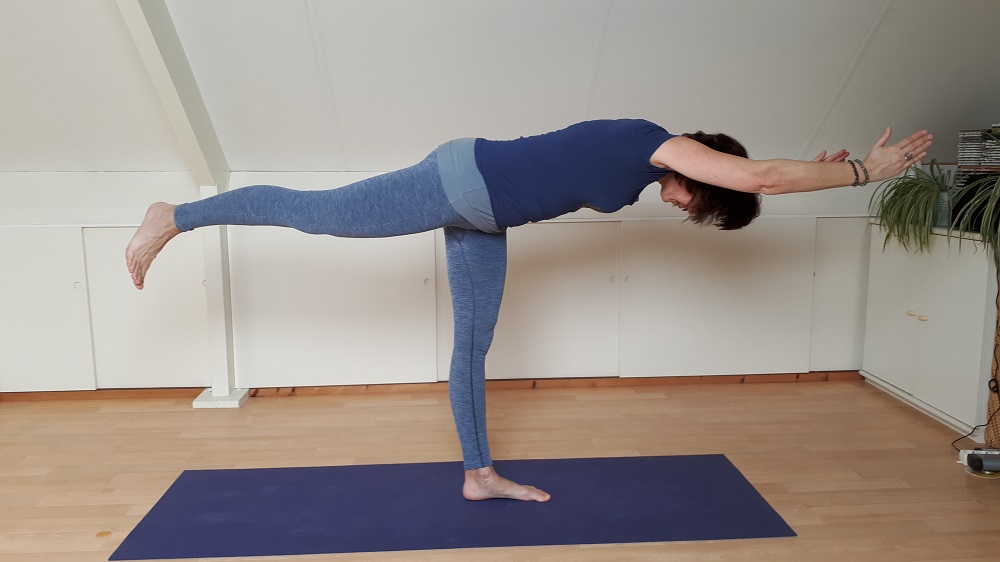
This screenshot has height=562, width=1000. I want to click on floor, so click(810, 437).